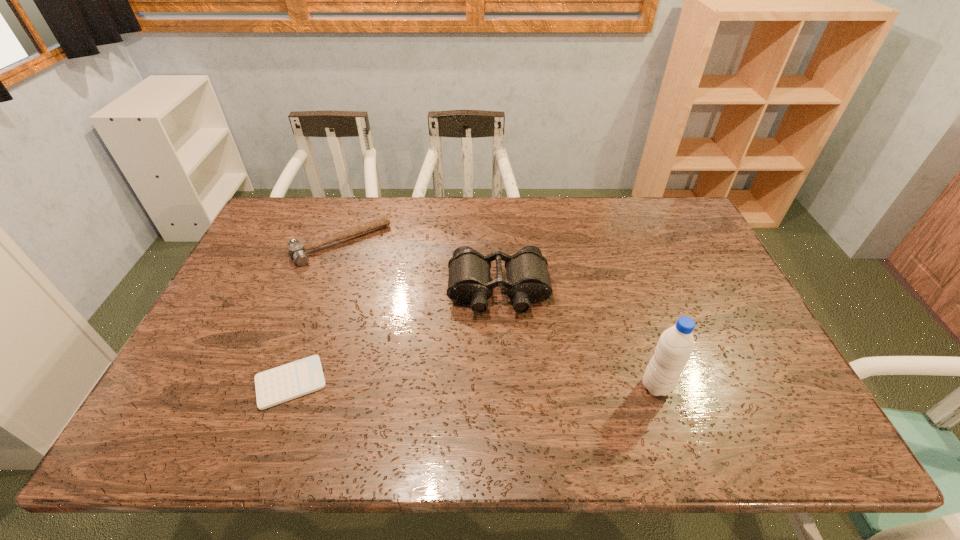
The height and width of the screenshot is (540, 960). I want to click on free space on the desktop that is between the calculator and the water bottle and is positioned on the striking face of the hammer, so click(x=425, y=384).

The height and width of the screenshot is (540, 960). What are the coordinates of `free space on the desktop that is between the calculator and the rightmost object and is positioned through the eyepieces of the third object from left to right` in the screenshot? It's located at (504, 384).